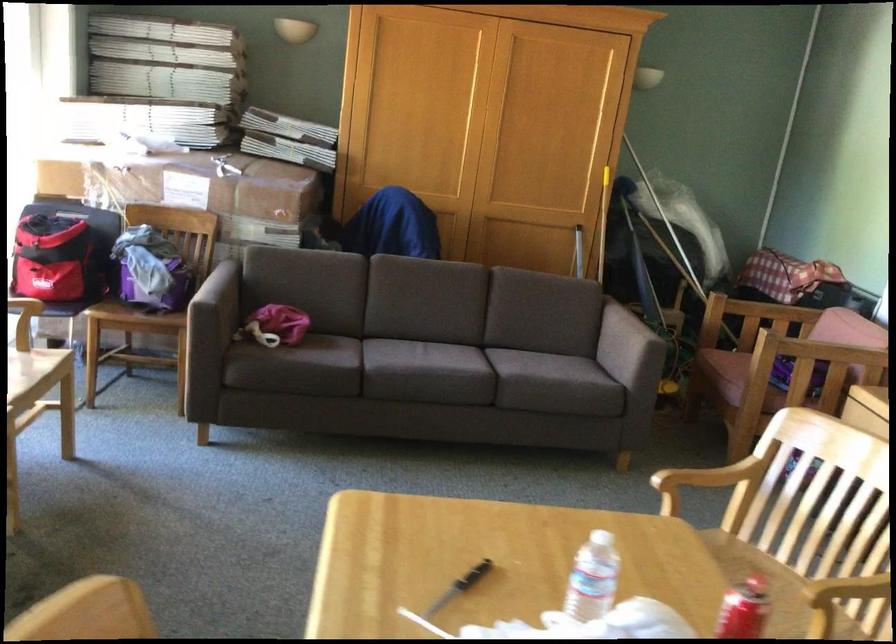
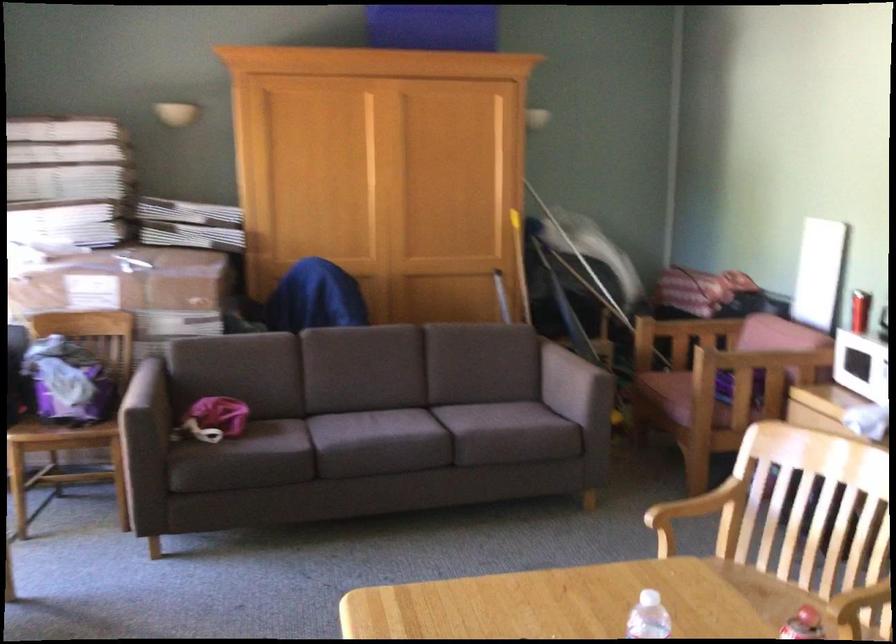
In the second image, find the point that corresponds to pixel 514 374 in the first image.

(467, 430)